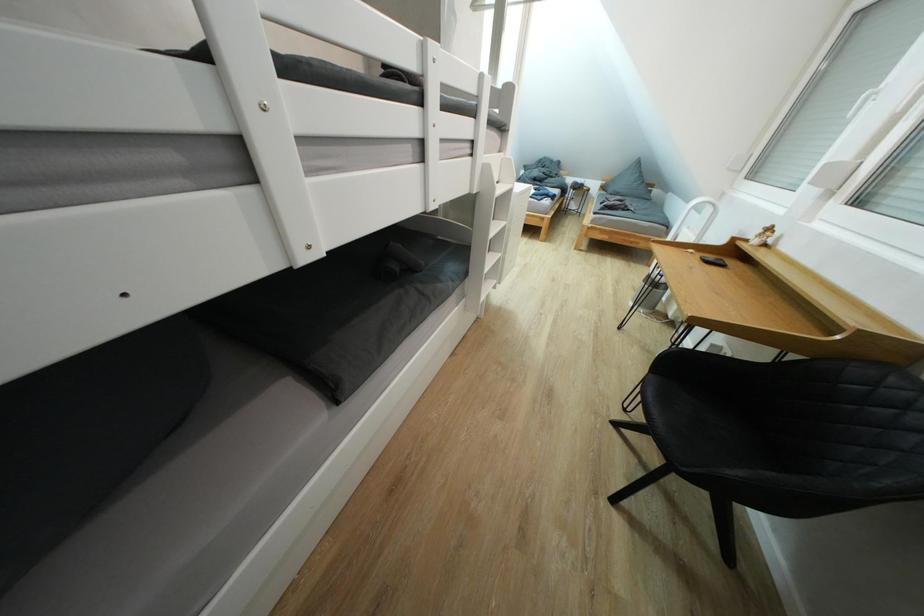
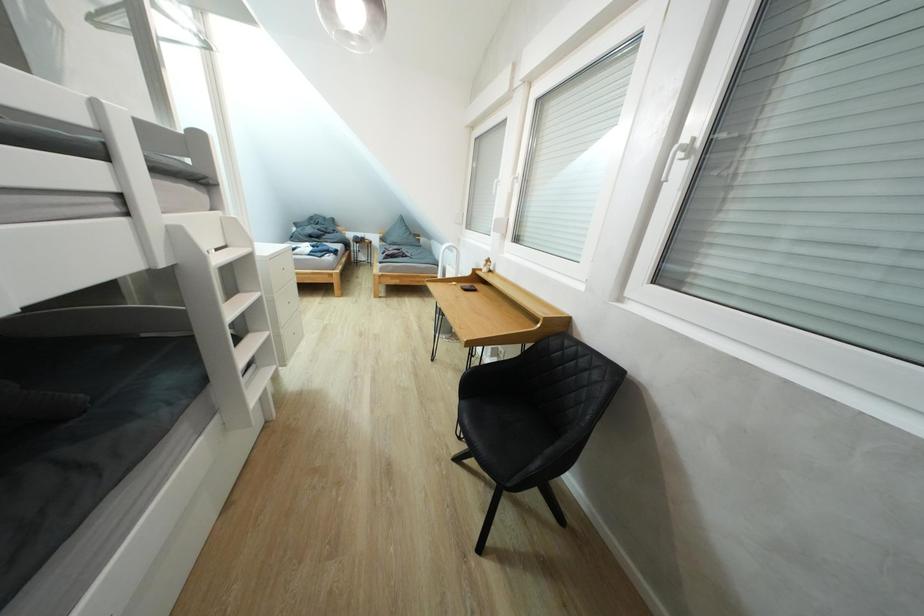
Question: The first image is from the beginning of the video and the second image is from the end. How did the camera likely rotate when shooting the video?

Choices:
 (A) Left
 (B) Right
 (C) Up
 (D) Down

Answer: (B)